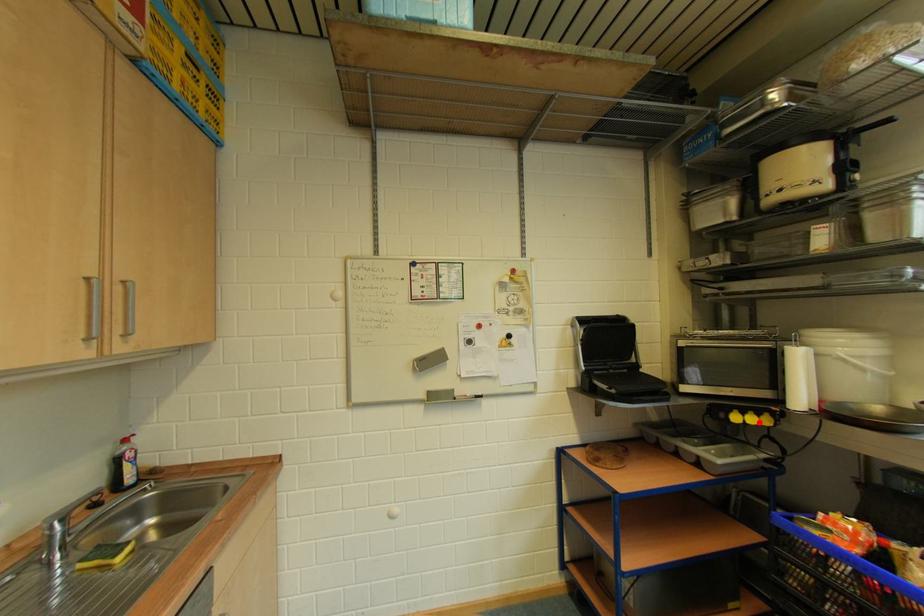
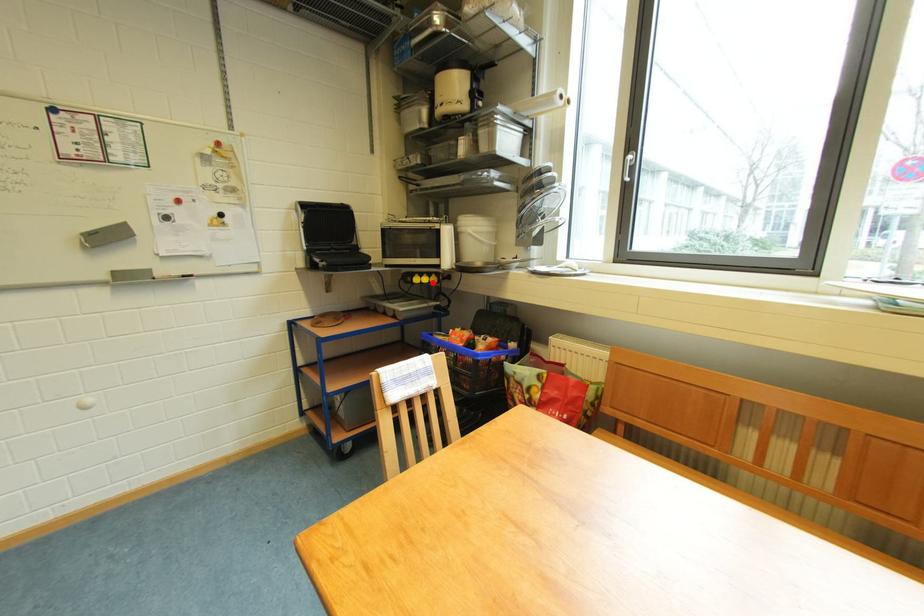
I am providing you with two images of the same scene from different viewpoints. A red point is marked on the first image and another point is marked on the second image. Are the points marked in image1 and image2 representing the same 3D position?

Yes